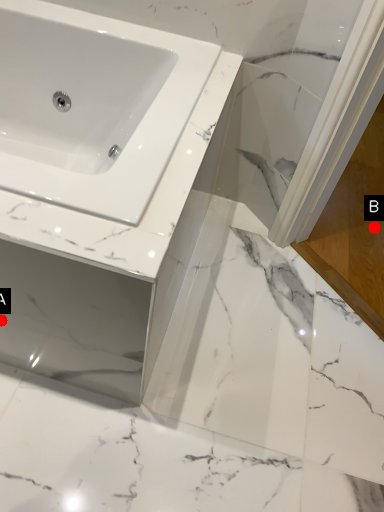
Question: Two points are circled on the image, labeled by A and B beside each circle. Which point is closer to the camera taking this photo?

Choices:
 (A) A is closer
 (B) B is closer

Answer: (A)